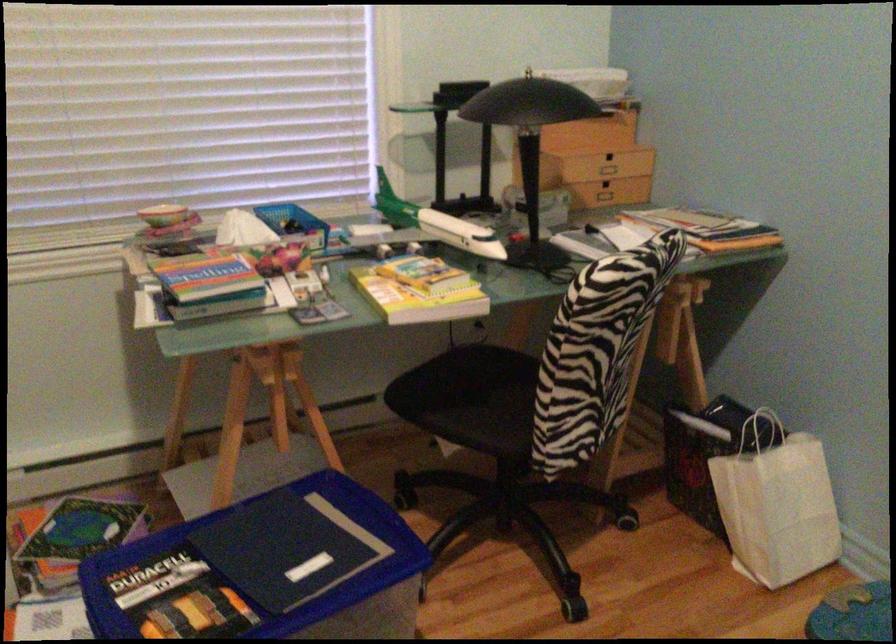
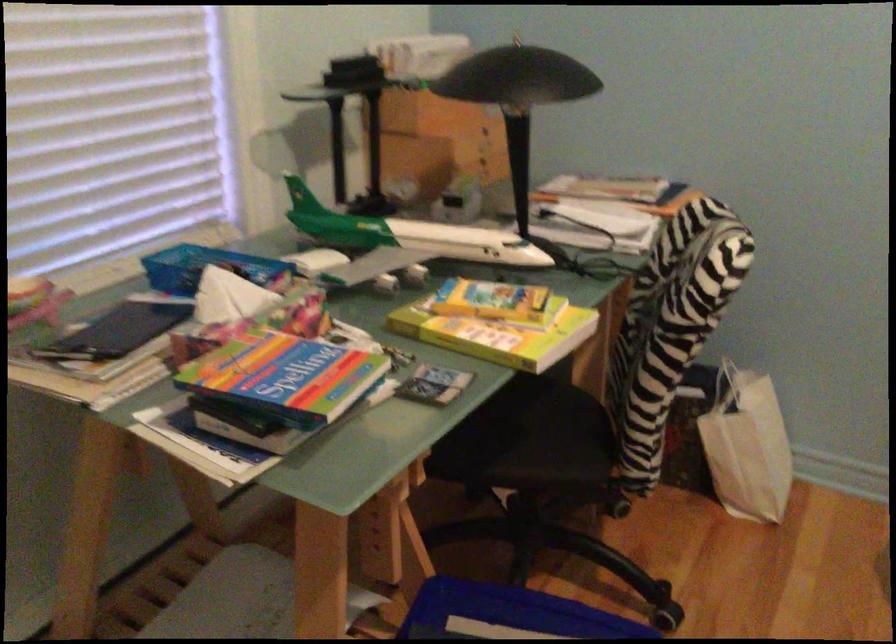
In the second image, find the point that corresponds to (x=426, y=219) in the first image.

(408, 232)